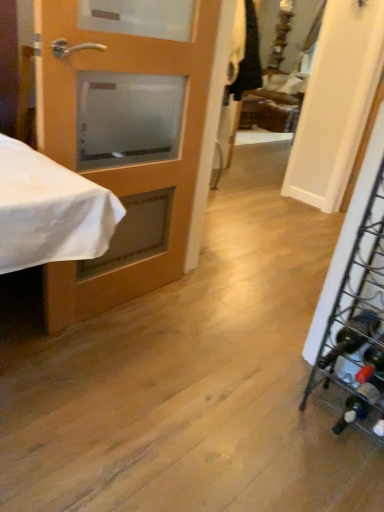
Question: Is matte wood door at left smaller than metallic wire wine rack at right?

Choices:
 (A) no
 (B) yes

Answer: (A)

Question: Does matte wood door at left come behind metallic wire wine rack at right?

Choices:
 (A) yes
 (B) no

Answer: (A)

Question: From a real-world perspective, is matte wood door at left physically above metallic wire wine rack at right?

Choices:
 (A) yes
 (B) no

Answer: (A)

Question: Is the position of matte wood door at left less distant than that of metallic wire wine rack at right?

Choices:
 (A) no
 (B) yes

Answer: (A)

Question: Can you confirm if matte wood door at left is wider than metallic wire wine rack at right?

Choices:
 (A) no
 (B) yes

Answer: (A)

Question: Is metallic wire wine rack at right located within matte wood door at left?

Choices:
 (A) yes
 (B) no

Answer: (B)

Question: From a real-world perspective, is metallic wire wine rack at right under matte wood door at left?

Choices:
 (A) yes
 (B) no

Answer: (A)

Question: Does metallic wire wine rack at right come in front of matte wood door at left?

Choices:
 (A) yes
 (B) no

Answer: (A)

Question: Is metallic wire wine rack at right smaller than matte wood door at left?

Choices:
 (A) no
 (B) yes

Answer: (B)

Question: Would you say metallic wire wine rack at right is outside matte wood door at left?

Choices:
 (A) no
 (B) yes

Answer: (B)

Question: Considering the relative positions of metallic wire wine rack at right and matte wood door at left in the image provided, is metallic wire wine rack at right to the left of matte wood door at left from the viewer's perspective?

Choices:
 (A) yes
 (B) no

Answer: (B)

Question: Does metallic wire wine rack at right have a greater width compared to matte wood door at left?

Choices:
 (A) no
 (B) yes

Answer: (B)

Question: In terms of size, does metallic wire wine rack at right appear bigger or smaller than matte wood door at left?

Choices:
 (A) big
 (B) small

Answer: (B)